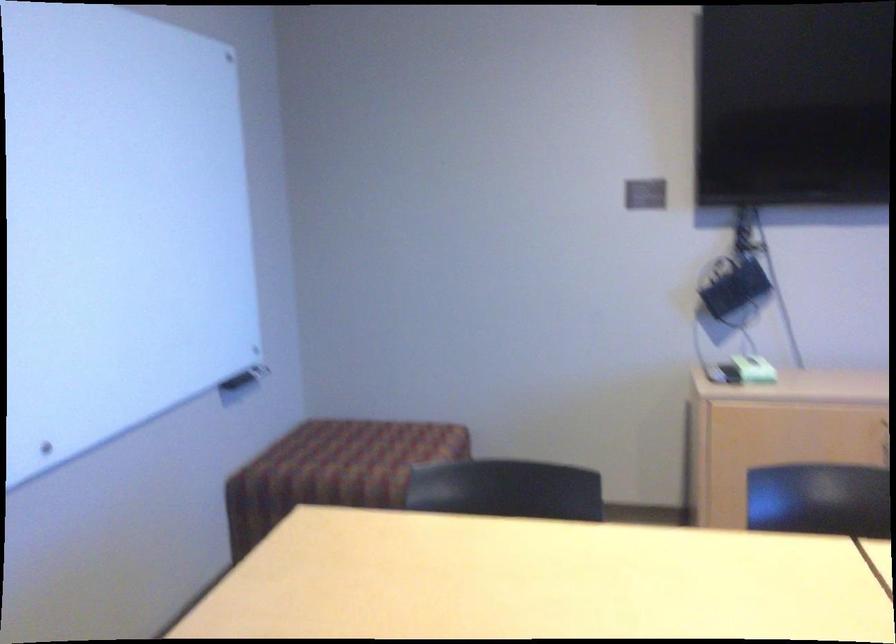
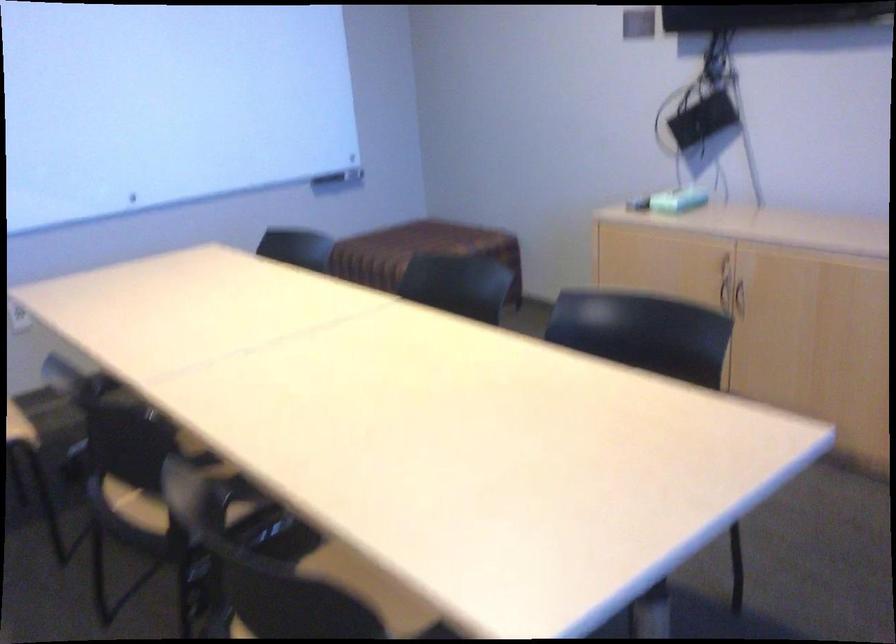
Locate, in the second image, the point that corresponds to the point at 254,383 in the first image.

(339, 178)